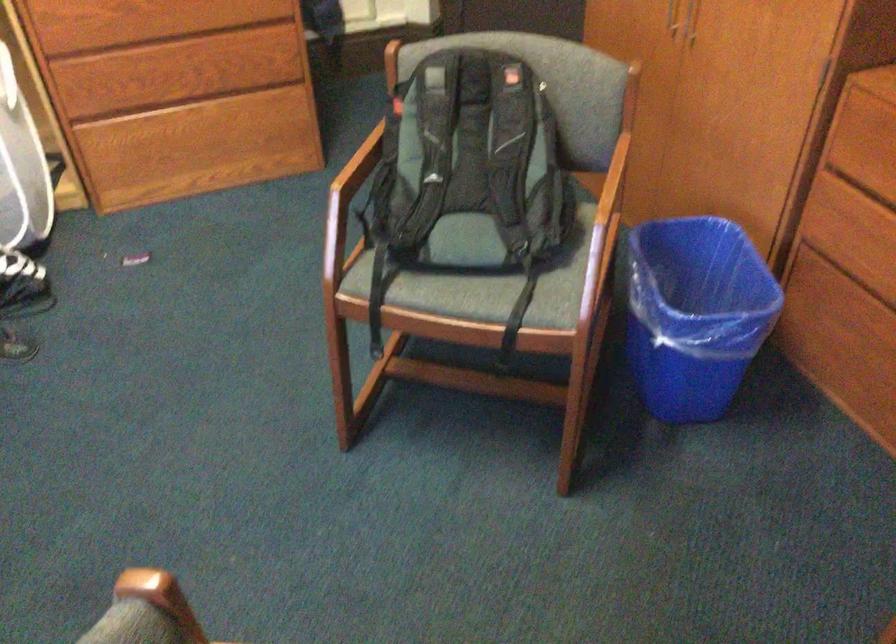
At what (x,y) coordinates should I click in order to perform the action: click on black backpack handle. Please return your answer as a coordinate pair (x, y). The height and width of the screenshot is (644, 896). Looking at the image, I should click on (470, 62).